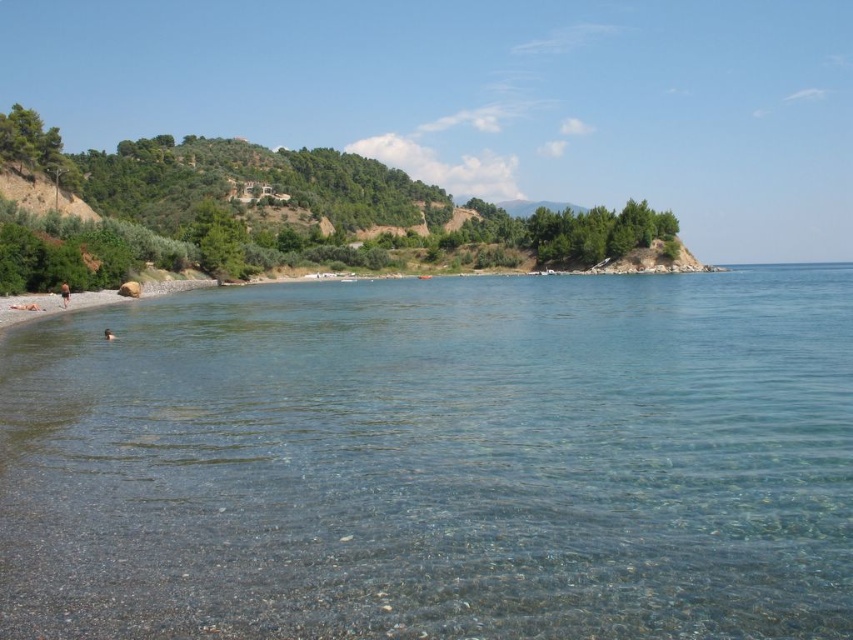
You are a swimmer standing on the beach and see the clear water at lower left and the brown skin at lower left. Which one is closer to you?

The clear water at lower left is closer to you because it is in front of the brown skin at lower left.

You are standing at the rocky embankment on the left side of the coastal scene. You want to walk towards the water but need to choose between two paths marked by the points point (131, 364) and point (62, 300). Which path is closer to the shoreline?

Point (131, 364) is in front of point (62, 300), so the path marked by point (131, 364) is closer to the shoreline.